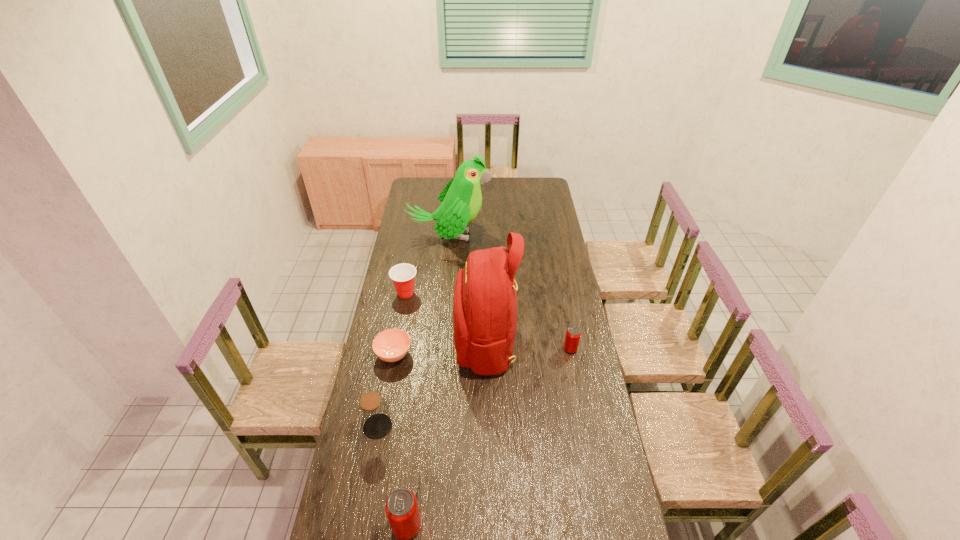
To achieve even spacing by inserting another can among them, please point to a vacant spot for this new can. Please provide its 2D coordinates. Your answer should be formatted as a tuple, i.e. [(x, y)], where the tuple contains the x and y coordinates of a point satisfying the conditions above.

[(501, 423)]